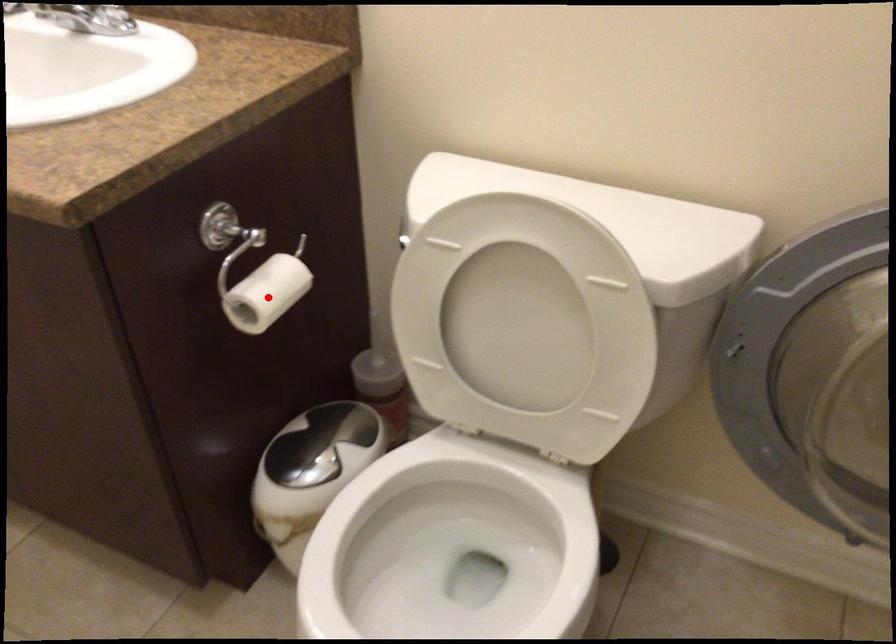
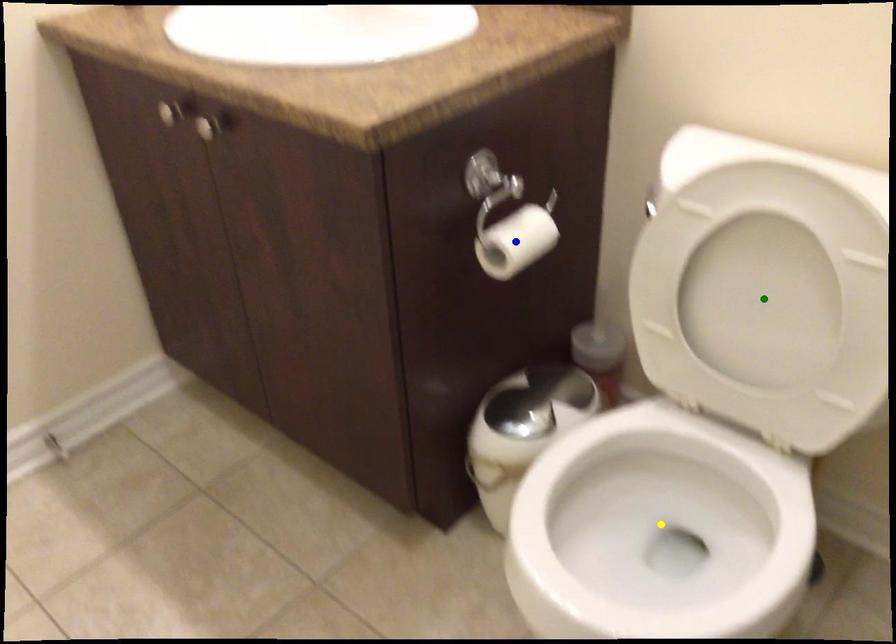
Question: I am providing you with two images of the same scene from different viewpoints. A red point is marked on the first image. You are given multiple points on the second image. Which mark in image 2 goes with the point in image 1?

Choices:
 (A) blue point
 (B) green point
 (C) yellow point

Answer: (A)